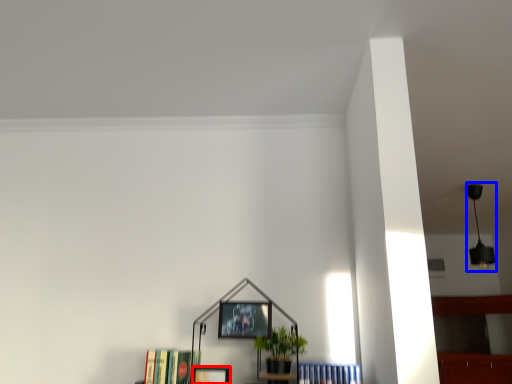
Question: Which of the following is the farthest to the observer, picture frame (highlighted by a red box) or lamp (highlighted by a blue box)?

Choices:
 (A) picture frame
 (B) lamp

Answer: (B)